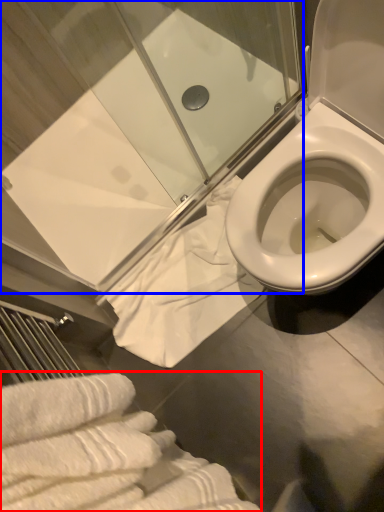
Question: Which object appears farthest to the camera in this image, bath towel (highlighted by a red box) or shower door (highlighted by a blue box)?

Choices:
 (A) bath towel
 (B) shower door

Answer: (B)